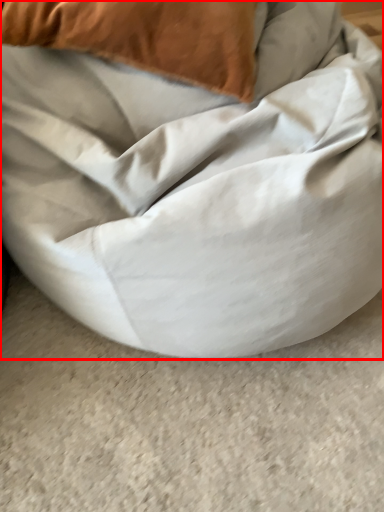
Question: From the image's perspective, where is furniture (annotated by the red box) located in relation to pillow in the image?

Choices:
 (A) above
 (B) below

Answer: (B)